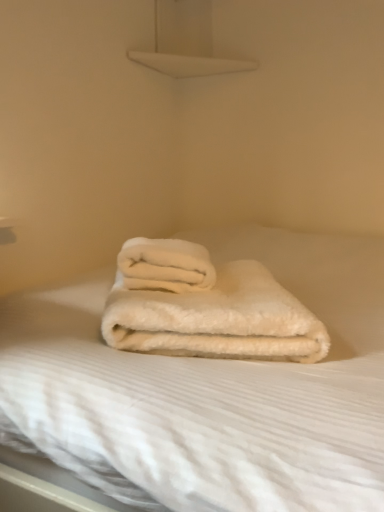
What is the approximate height of white fluffy blanket at center?

34.52 inches.

The height and width of the screenshot is (512, 384). I want to click on white fluffy towel at center, which is counted as the 1th towel, starting from the top, so click(x=165, y=265).

Is white fluffy towel at center, which is counted as the 1th towel, starting from the bottom, taller than white fluffy blanket at center?

In fact, white fluffy towel at center, which is counted as the 1th towel, starting from the bottom, may be shorter than white fluffy blanket at center.

Does white fluffy towel at center, which is counted as the 1th towel, starting from the bottom, have a greater width compared to white fluffy blanket at center?

No, white fluffy towel at center, which is counted as the 1th towel, starting from the bottom, is not wider than white fluffy blanket at center.

Is white fluffy towel at center, which is counted as the 1th towel, starting from the bottom, touching white fluffy blanket at center?

white fluffy towel at center, which is counted as the 1th towel, starting from the bottom, and white fluffy blanket at center are not in contact.

Does white fluffy towel at center, the 2th towel positioned from the top, appear on the left side of white fluffy towel at center, which is counted as the 1th towel, starting from the top?

Incorrect, white fluffy towel at center, the 2th towel positioned from the top, is not on the left side of white fluffy towel at center, which is counted as the 1th towel, starting from the top.

Can you tell me how much white fluffy towel at center, the 2th towel positioned from the top, and white fluffy towel at center, which is counted as the 1th towel, starting from the top, differ in facing direction?

The facing directions of white fluffy towel at center, the 2th towel positioned from the top, and white fluffy towel at center, which is counted as the 1th towel, starting from the top, are 0.005 degrees apart.

Is point (286, 330) positioned before point (154, 283)?

Yes, it is.

From the image's perspective, is white fluffy towel at center, which is counted as the 1th towel, starting from the bottom, over white fluffy towel at center, which is counted as the 1th towel, starting from the top?

No, from the image's perspective, white fluffy towel at center, which is counted as the 1th towel, starting from the bottom, is not over white fluffy towel at center, which is counted as the 1th towel, starting from the top.

The height and width of the screenshot is (512, 384). I want to click on the 1st towel behind the white fluffy blanket at center, so click(217, 319).

Based on the photo, from a real-world perspective, relative to white fluffy towel at center, which is counted as the 1th towel, starting from the bottom, is white fluffy blanket at center vertically above or below?

Clearly, from a real-world perspective, white fluffy blanket at center is below white fluffy towel at center, which is counted as the 1th towel, starting from the bottom.

How much distance is there between white fluffy blanket at center and white fluffy towel at center, which is counted as the 1th towel, starting from the bottom?

The distance of white fluffy blanket at center from white fluffy towel at center, which is counted as the 1th towel, starting from the bottom, is 10.80 centimeters.

How many degrees apart are the facing directions of white fluffy blanket at center and white fluffy towel at center, the 2th towel positioned from the top?

117 degrees.

Is white fluffy blanket at center oriented away from white fluffy towel at center, which is counted as the 1th towel, starting from the top?

No, white fluffy towel at center, which is counted as the 1th towel, starting from the top, is not at the back of white fluffy blanket at center.

Does point (105, 366) come behind point (174, 291)?

That is False.

Does white fluffy blanket at center lie behind white fluffy towel at center, the 2th towel positioned from the bottom?

No, it is in front of white fluffy towel at center, the 2th towel positioned from the bottom.

From the image's perspective, which is below, white fluffy blanket at center or white fluffy towel at center, which is counted as the 1th towel, starting from the top?

white fluffy blanket at center.

Does white fluffy towel at center, the 2th towel positioned from the bottom, lie in front of white fluffy blanket at center?

No, it is not.

Is white fluffy towel at center, the 2th towel positioned from the bottom, next to white fluffy blanket at center?

They are not placed beside each other.

Choose the correct answer: Is white fluffy towel at center, the 2th towel positioned from the bottom, inside white fluffy blanket at center or outside it?

white fluffy towel at center, the 2th towel positioned from the bottom, is inside white fluffy blanket at center.

This screenshot has height=512, width=384. I want to click on towel below the white fluffy towel at center, which is counted as the 1th towel, starting from the top (from a real-world perspective), so click(217, 319).

Which is more to the left, white fluffy towel at center, the 2th towel positioned from the bottom, or white fluffy towel at center, the 2th towel positioned from the top?

white fluffy towel at center, the 2th towel positioned from the bottom.

Is white fluffy towel at center, the 2th towel positioned from the top, at the back of white fluffy towel at center, which is counted as the 1th towel, starting from the top?

No.

From a real-world perspective, which towel is the 1st one above the white fluffy blanket at center? Please provide its 2D coordinates.

[(217, 319)]

Find the location of a particular element. Image resolution: width=384 pixels, height=512 pixels. towel below the white fluffy towel at center, the 2th towel positioned from the bottom (from a real-world perspective) is located at coordinates (217, 319).

Looking at the image, which one is located further to white fluffy towel at center, which is counted as the 1th towel, starting from the top, white fluffy blanket at center or white fluffy towel at center, which is counted as the 1th towel, starting from the bottom?

Based on the image, white fluffy blanket at center appears to be further to white fluffy towel at center, which is counted as the 1th towel, starting from the top.

Looking at the image, which one is located closer to white fluffy towel at center, which is counted as the 1th towel, starting from the bottom, white fluffy blanket at center or white fluffy towel at center, the 2th towel positioned from the bottom?

Among the two, white fluffy towel at center, the 2th towel positioned from the bottom, is located nearer to white fluffy towel at center, which is counted as the 1th towel, starting from the bottom.

When comparing their distances from white fluffy blanket at center, does white fluffy towel at center, which is counted as the 1th towel, starting from the top, or white fluffy towel at center, the 2th towel positioned from the top, seem closer?

white fluffy towel at center, the 2th towel positioned from the top.

Looking at the image, which one is located closer to white fluffy towel at center, the 2th towel positioned from the bottom, white fluffy towel at center, which is counted as the 1th towel, starting from the bottom, or white fluffy blanket at center?

white fluffy towel at center, which is counted as the 1th towel, starting from the bottom, lies closer to white fluffy towel at center, the 2th towel positioned from the bottom, than the other object.

Estimate the real-world distances between objects in this image. Which object is further from white fluffy towel at center, the 2th towel positioned from the top, white fluffy towel at center, which is counted as the 1th towel, starting from the top, or white fluffy blanket at center?

white fluffy blanket at center is further to white fluffy towel at center, the 2th towel positioned from the top.

From the image, which object appears to be nearer to white fluffy blanket at center, white fluffy towel at center, which is counted as the 1th towel, starting from the bottom, or white fluffy towel at center, the 2th towel positioned from the bottom?

white fluffy towel at center, which is counted as the 1th towel, starting from the bottom, is closer to white fluffy blanket at center.

Find the location of a particular element. The height and width of the screenshot is (512, 384). towel between white fluffy blanket at center and white fluffy towel at center, which is counted as the 1th towel, starting from the top, along the z-axis is located at coordinates (217, 319).